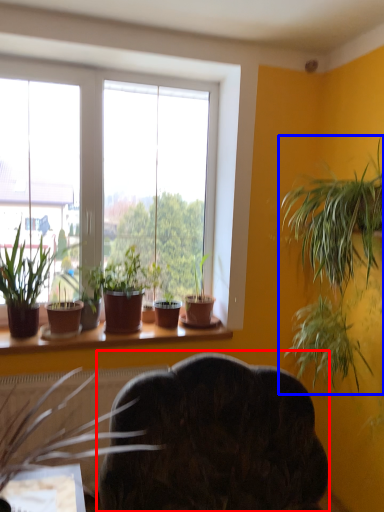
Question: Which of the following is the farthest to the observer, swivel chair (highlighted by a red box) or houseplant (highlighted by a blue box)?

Choices:
 (A) swivel chair
 (B) houseplant

Answer: (B)